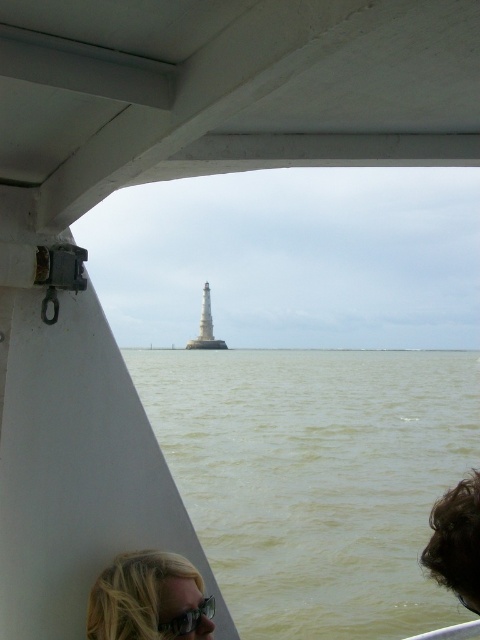
You are a diver preparing to jump into the water. You see the greenish water at center and the clear plastic goggles at lower center. Which object is closer to you?

The clear plastic goggles at lower center are closer to you because the greenish water at center is further away.